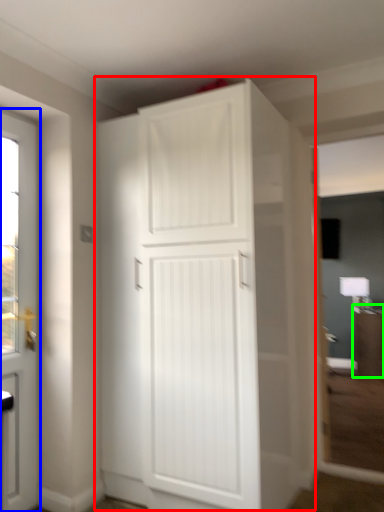
Question: Based on their relative distances, which object is farther from cupboard (highlighted by a red box)? Choose from door (highlighted by a blue box) and cabinetry (highlighted by a green box).

Choices:
 (A) door
 (B) cabinetry

Answer: (B)